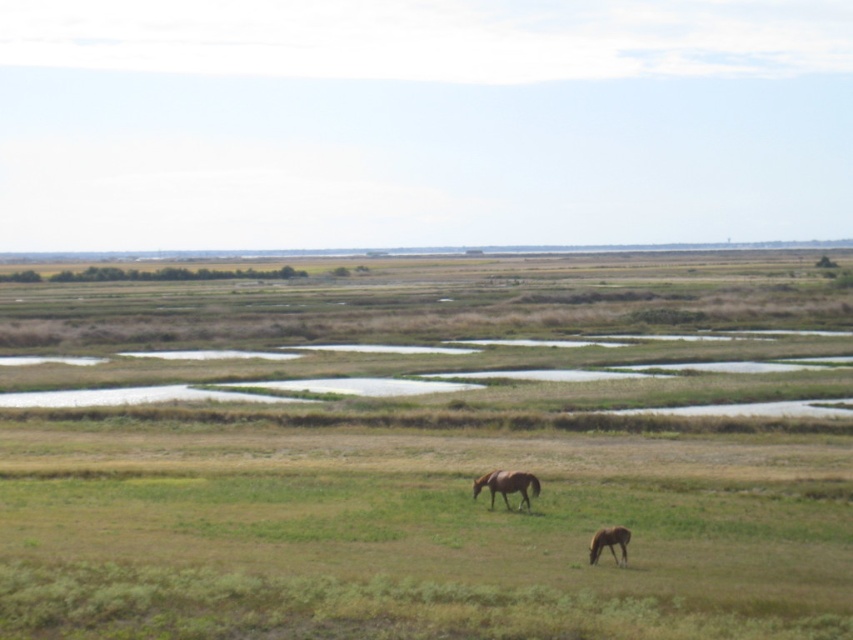
Question: Which object is farther from the camera taking this photo?

Choices:
 (A) brown glossy horse at lower right
 (B) brown glossy horse at center

Answer: (B)

Question: Does brown glossy horse at center appear under brown glossy horse at lower right?

Choices:
 (A) no
 (B) yes

Answer: (A)

Question: Can you confirm if brown glossy horse at center is thinner than brown glossy horse at lower right?

Choices:
 (A) yes
 (B) no

Answer: (B)

Question: Which object appears farthest from the camera in this image?

Choices:
 (A) brown glossy horse at lower right
 (B) brown glossy horse at center

Answer: (B)

Question: Which of the following is the closest to the observer?

Choices:
 (A) (613, 540)
 (B) (476, 492)

Answer: (A)

Question: Considering the relative positions of brown glossy horse at center and brown glossy horse at lower right in the image provided, where is brown glossy horse at center located with respect to brown glossy horse at lower right?

Choices:
 (A) left
 (B) right

Answer: (A)